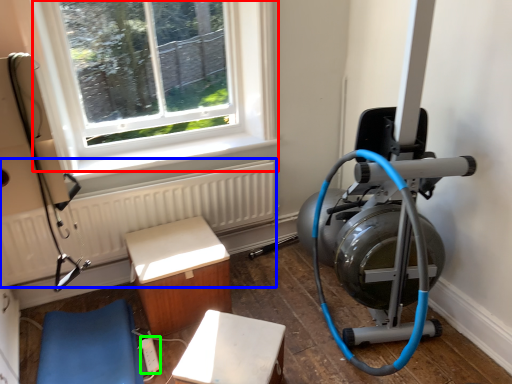
Question: Based on their relative distances, which object is nearer to window (highlighted by a red box)? Choose from radiator (highlighted by a blue box) and extension cord (highlighted by a green box).

Choices:
 (A) radiator
 (B) extension cord

Answer: (A)